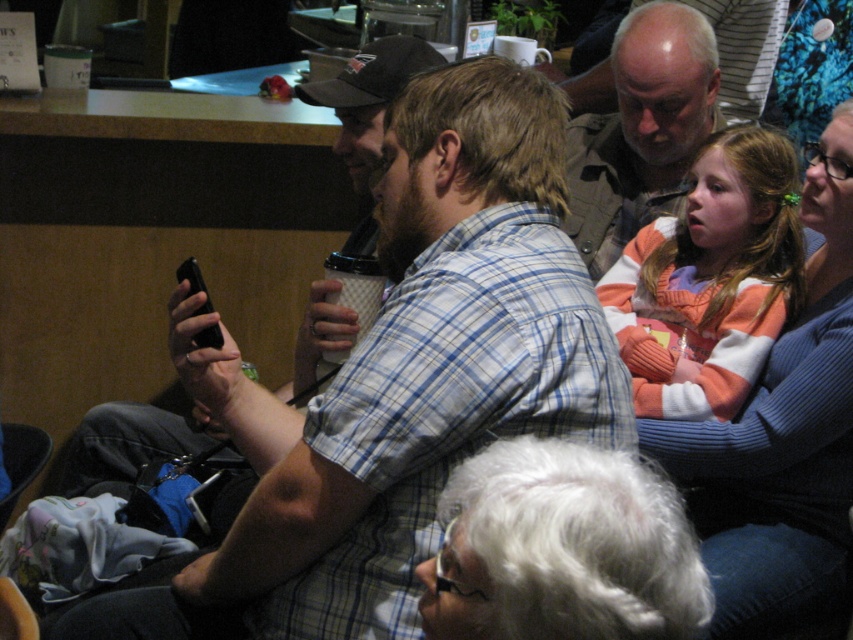
In the scene described, there are two people wearing an orange sweater at upper right and a matte khaki shirt at upper center. Which of these two individuals is positioned higher up in the image?

The orange sweater at upper right is positioned higher up in the image than the matte khaki shirt at upper center because it is taller as described.

You are standing in the cafe scene. There is a striped sweater at upper right represented by point (711, 280). Can you tell me the coordinates of the striped sweater at upper right?

The striped sweater at upper right is represented by point (711, 280).

Based on the photo, you are organizing a photo shoot and need to place a prop that requires a larger space. Which person should you avoid placing it near, the striped sweater at upper right or the matte khaki shirt at upper center?

You should avoid placing the prop near the striped sweater at upper right because it is smaller than the matte khaki shirt at upper center, meaning there is less space around it.